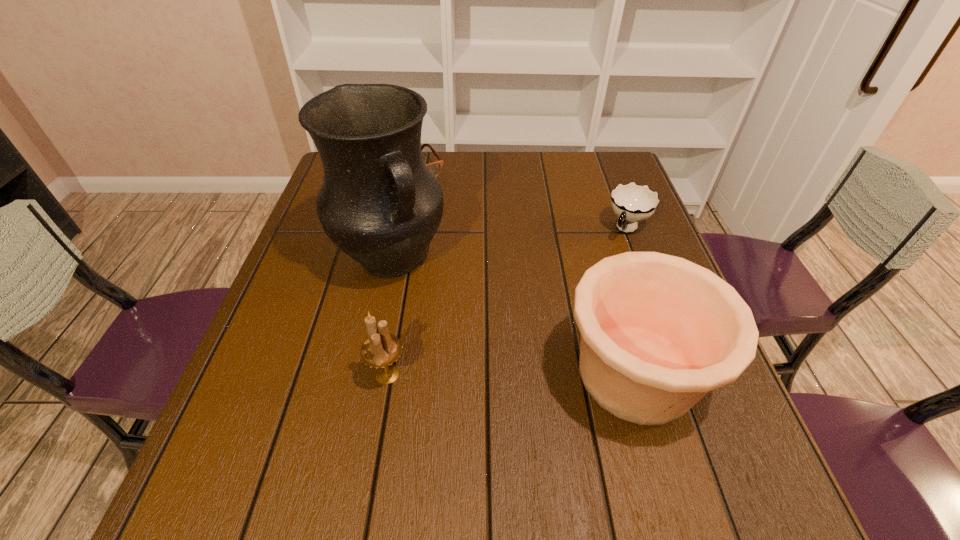
The width and height of the screenshot is (960, 540). I want to click on vacant space on the desktop that is between the candle holder and the pottery and is positioned on the front-facing side of the spectacles, so click(533, 374).

Identify the location of free space on the desktop that is between the candle holder and the pottery and is positioned on the side of the second shortest object with the handle. 529,374.

Where is `free space on the desktop that is between the candle holder and the pottery and is positioned on the handle side of the pitcher`? This screenshot has width=960, height=540. free space on the desktop that is between the candle holder and the pottery and is positioned on the handle side of the pitcher is located at coordinates (480, 374).